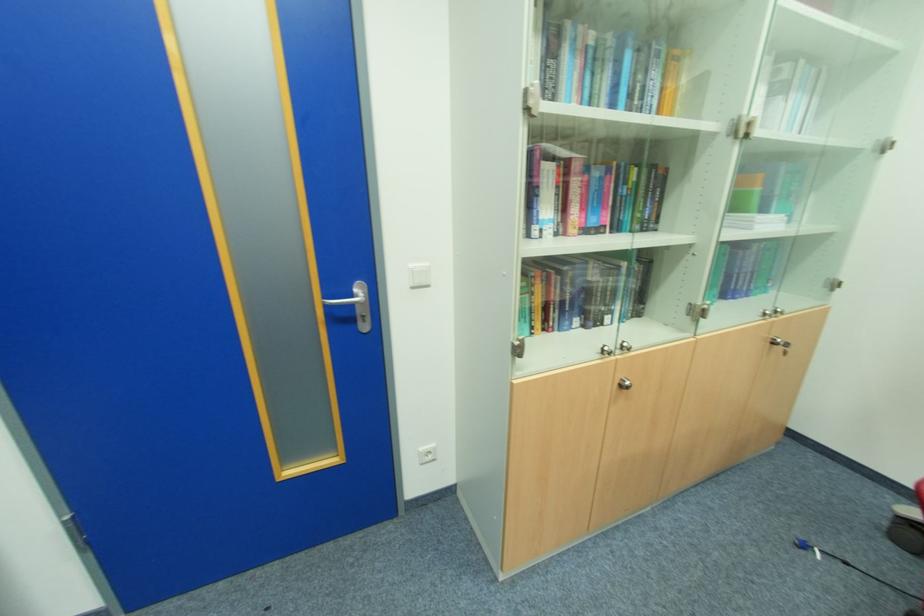
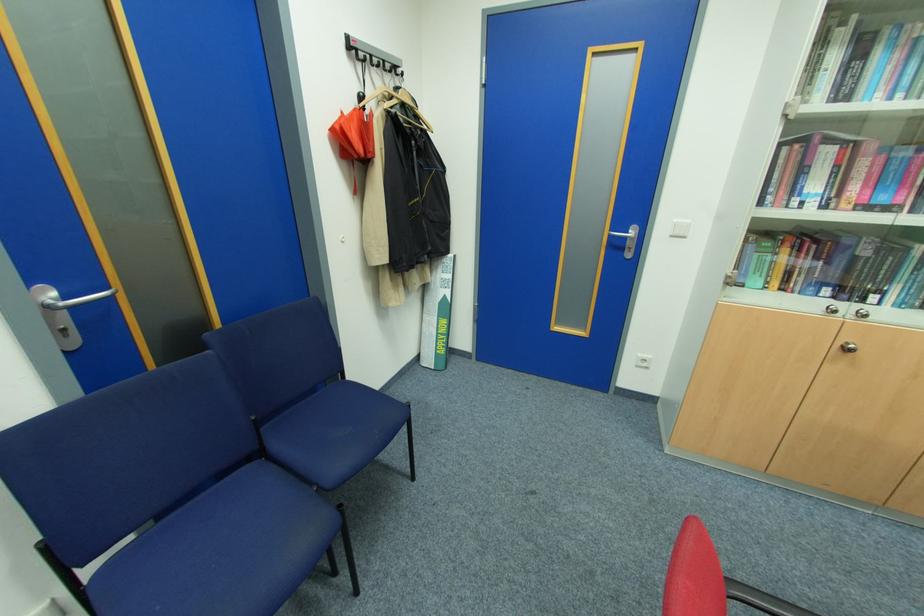
Locate, in the second image, the point that corresponds to (x=602, y=351) in the first image.

(830, 310)